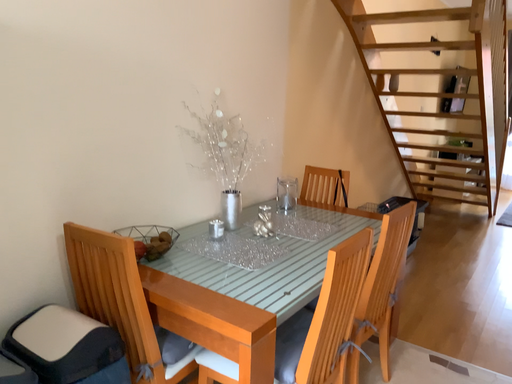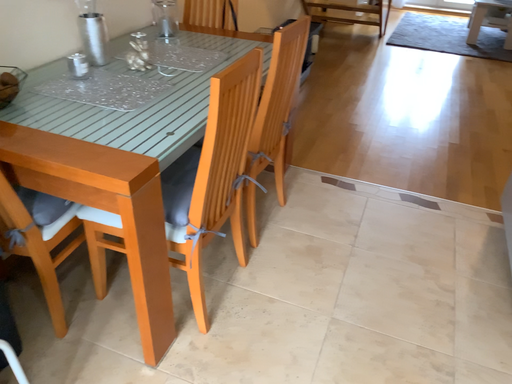
Question: How did the camera likely rotate when shooting the video?

Choices:
 (A) rotated downward
 (B) rotated upward

Answer: (A)